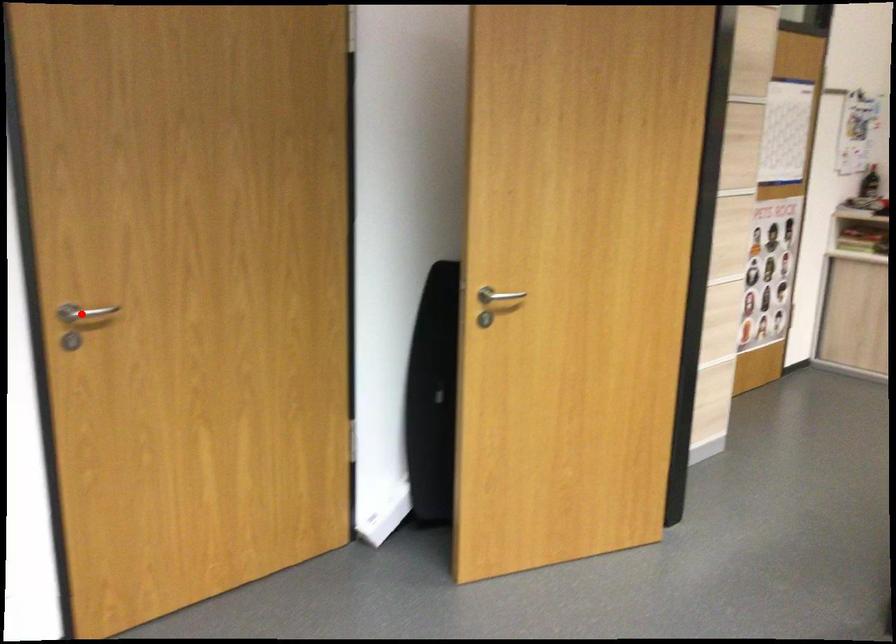
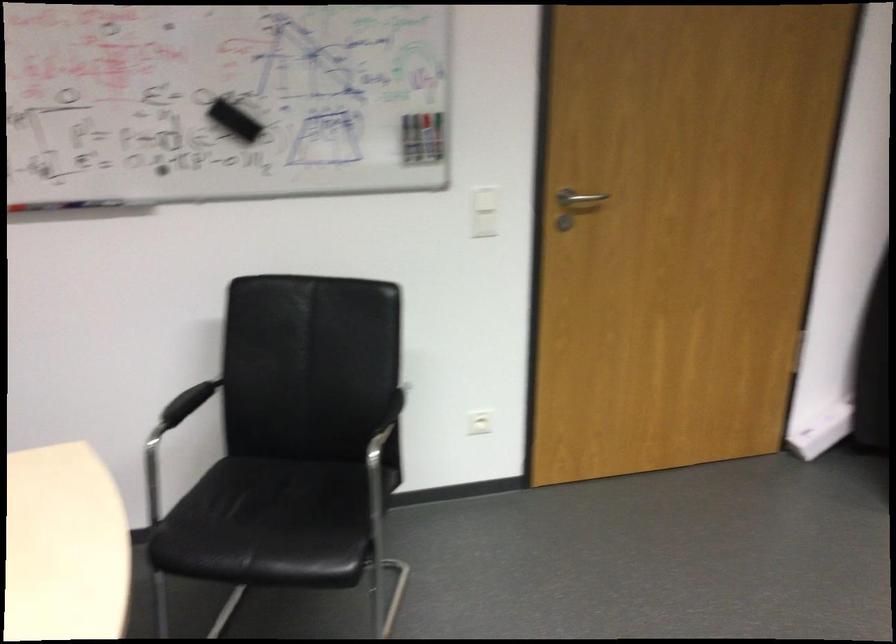
Question: A red point is marked in image1. In image2, is the corresponding 3D point closer to the camera or farther? Reply with the corresponding letter.

Choices:
 (A) The corresponding 3D point is closer.
 (B) The corresponding 3D point is farther.

Answer: (B)